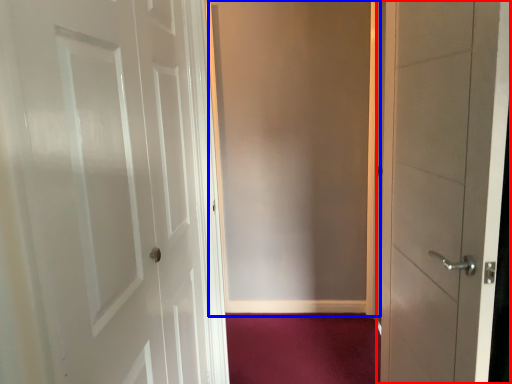
Question: Among these objects, which one is nearest to the camera, door (highlighted by a red box) or screen door (highlighted by a blue box)?

Choices:
 (A) door
 (B) screen door

Answer: (A)